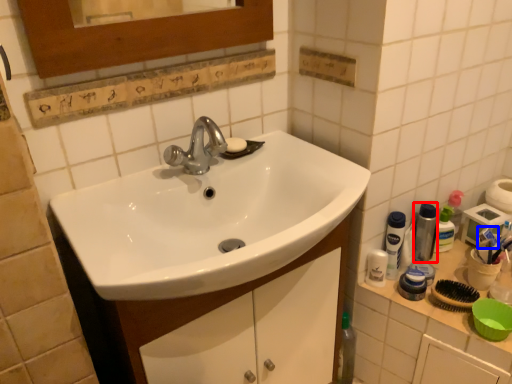
Question: Which object is further to the camera taking this photo, mouthwash (highlighted by a red box) or toothpaste (highlighted by a blue box)?

Choices:
 (A) mouthwash
 (B) toothpaste

Answer: (B)